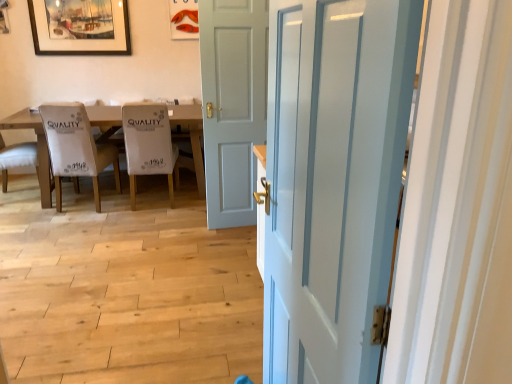
Question: Should I look upward or downward to see white fabric chair at left, which is the first chair in left-to-right order?

Choices:
 (A) up
 (B) down

Answer: (A)

Question: Is white glossy door at center, which appears as the first door when viewed from the right, shorter than white fabric chair at left, which is the 2th chair from left to right?

Choices:
 (A) yes
 (B) no

Answer: (B)

Question: From the image's perspective, is white glossy door at center, arranged as the 2th door when viewed from the left, below white fabric chair at left, which is the 2th chair from left to right?

Choices:
 (A) no
 (B) yes

Answer: (B)

Question: Does white glossy door at center, arranged as the 2th door when viewed from the left, have a lesser width compared to white fabric chair at left, which is the 2th chair from left to right?

Choices:
 (A) no
 (B) yes

Answer: (B)

Question: Is white glossy door at center, the 2th door viewed from the back, in front of white fabric chair at left, the 2th chair viewed from the right?

Choices:
 (A) yes
 (B) no

Answer: (A)

Question: Is white glossy door at center, which appears as the first door when viewed from the right, further to camera compared to white fabric chair at left, which is the 2th chair from left to right?

Choices:
 (A) yes
 (B) no

Answer: (B)

Question: From the image's perspective, is white glossy door at center, arranged as the 2th door when viewed from the left, on top of white fabric chair at left, the 2th chair viewed from the right?

Choices:
 (A) no
 (B) yes

Answer: (A)

Question: From a real-world perspective, is white fabric chair at center, marked as the first chair in a right-to-left arrangement, beneath light gray wood door at center, which is counted as the second door, starting from the front?

Choices:
 (A) yes
 (B) no

Answer: (A)

Question: Is white fabric chair at center, placed as the 3th chair when sorted from left to right, far away from light gray wood door at center, which is the 2th door from right to left?

Choices:
 (A) yes
 (B) no

Answer: (B)

Question: Is white fabric chair at center, placed as the 3th chair when sorted from left to right, smaller than light gray wood door at center, which is the 2th door from right to left?

Choices:
 (A) yes
 (B) no

Answer: (B)

Question: Is white fabric chair at center, placed as the 3th chair when sorted from left to right, shorter than light gray wood door at center, which is counted as the second door, starting from the front?

Choices:
 (A) yes
 (B) no

Answer: (A)

Question: Is white fabric chair at center, placed as the 3th chair when sorted from left to right, wider than light gray wood door at center, which appears as the 1th door when viewed from the back?

Choices:
 (A) no
 (B) yes

Answer: (B)

Question: Does white fabric chair at center, placed as the 3th chair when sorted from left to right, appear on the left side of light gray wood door at center, which is counted as the second door, starting from the front?

Choices:
 (A) yes
 (B) no

Answer: (A)

Question: Is white fabric chair at center, placed as the 3th chair when sorted from left to right, positioned in front of white glossy door at center, the 2th door viewed from the back?

Choices:
 (A) yes
 (B) no

Answer: (B)